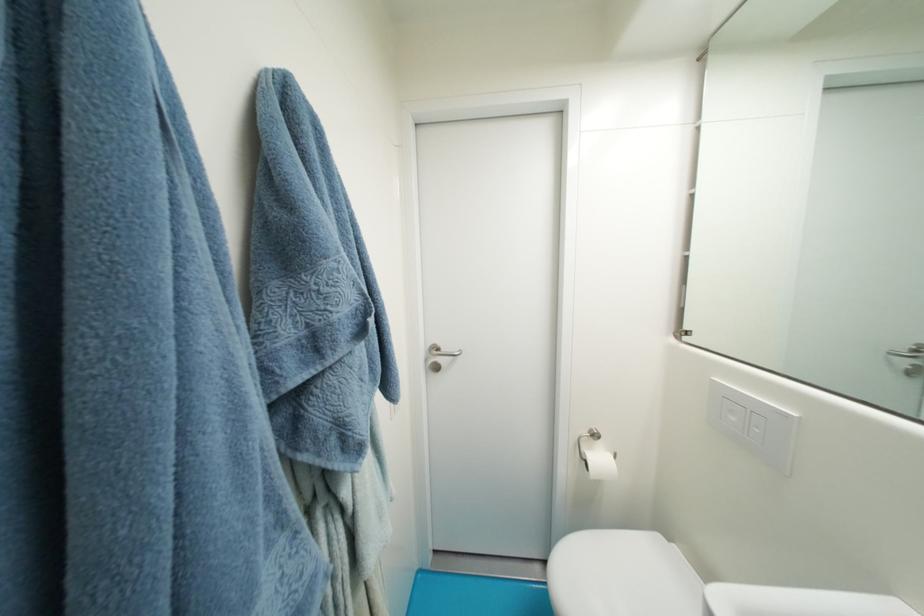
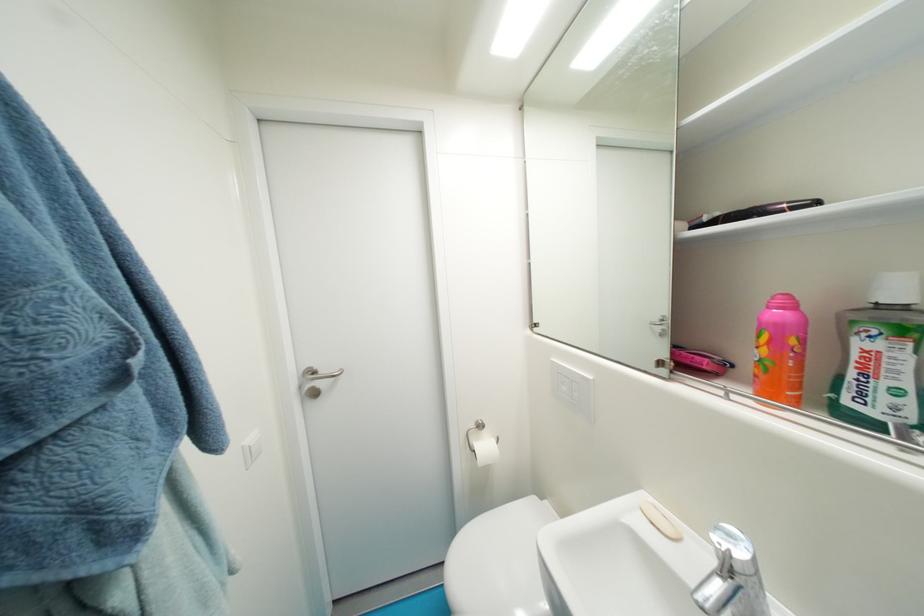
The point at (445, 351) is marked in the first image. Where is the corresponding point in the second image?

(322, 374)